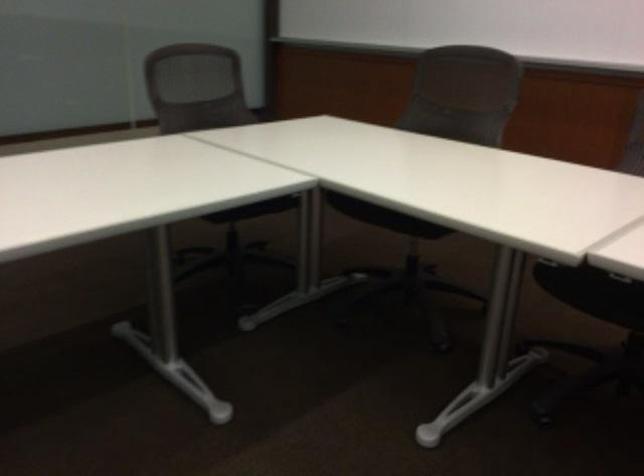
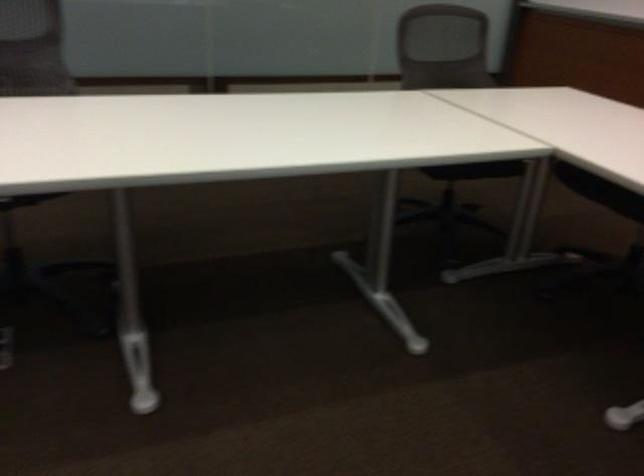
Question: The camera is either moving clockwise (left) or counter-clockwise (right) around the object. The first image is from the beginning of the video and the second image is from the end. Is the camera moving left or right when shooting the video?

Choices:
 (A) Left
 (B) Right

Answer: (B)